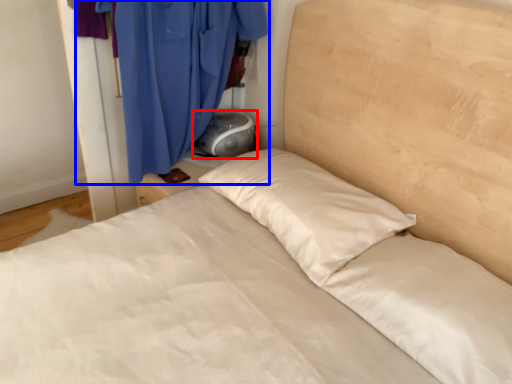
Question: Which object is closer to the camera taking this photo, gray (highlighted by a red box) or curtain (highlighted by a blue box)?

Choices:
 (A) gray
 (B) curtain

Answer: (B)